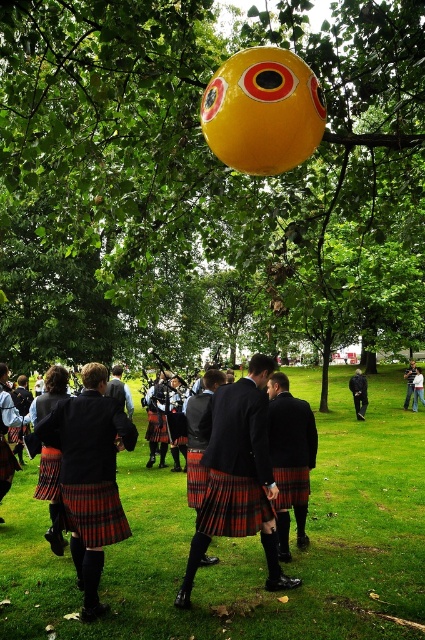
Question: Which object appears farthest from the camera in this image?

Choices:
 (A) plaid kilt at center
 (B) light blue denim jacket at center
 (C) black leather jacket at center
 (D) green grass at center

Answer: (B)

Question: Is green leafy tree at upper center thinner than black leather jacket at center?

Choices:
 (A) yes
 (B) no

Answer: (B)

Question: Observing the image, what is the correct spatial positioning of green leafy tree at upper center in reference to plaid kilt at center?

Choices:
 (A) above
 (B) below

Answer: (A)

Question: Is green leafy tree at upper center above red plaid kilt at center?

Choices:
 (A) no
 (B) yes

Answer: (B)

Question: Based on their relative distances, which object is farther from the plaid kilt at center?

Choices:
 (A) red plaid kilt at center
 (B) black leather jacket at center
 (C) matte black kilt at center
 (D) green grass at center

Answer: (B)

Question: Which of these objects is positioned closest to the matte black kilt at center?

Choices:
 (A) red plaid kilt at center
 (B) plaid kilt at center
 (C) green leafy tree at upper center
 (D) green grass at center

Answer: (A)